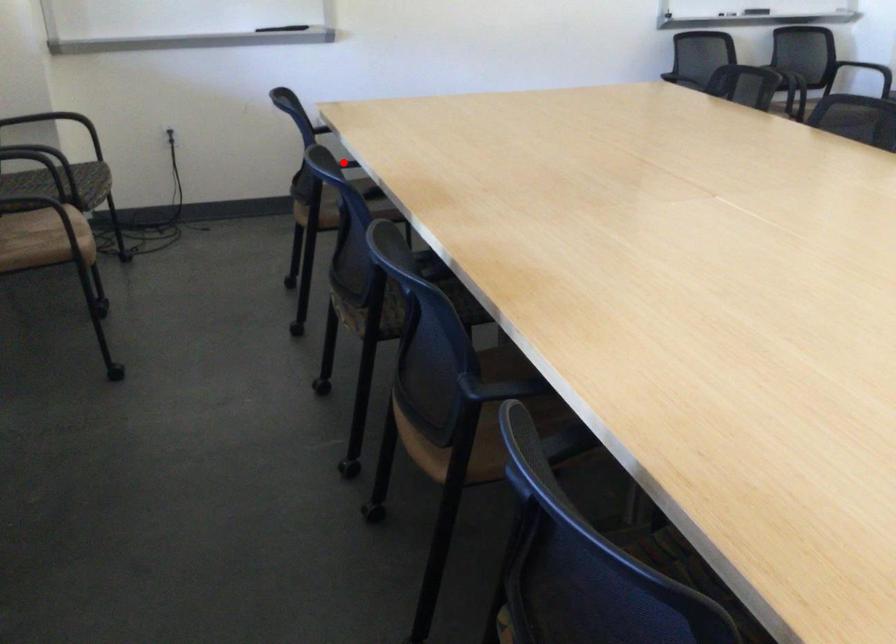
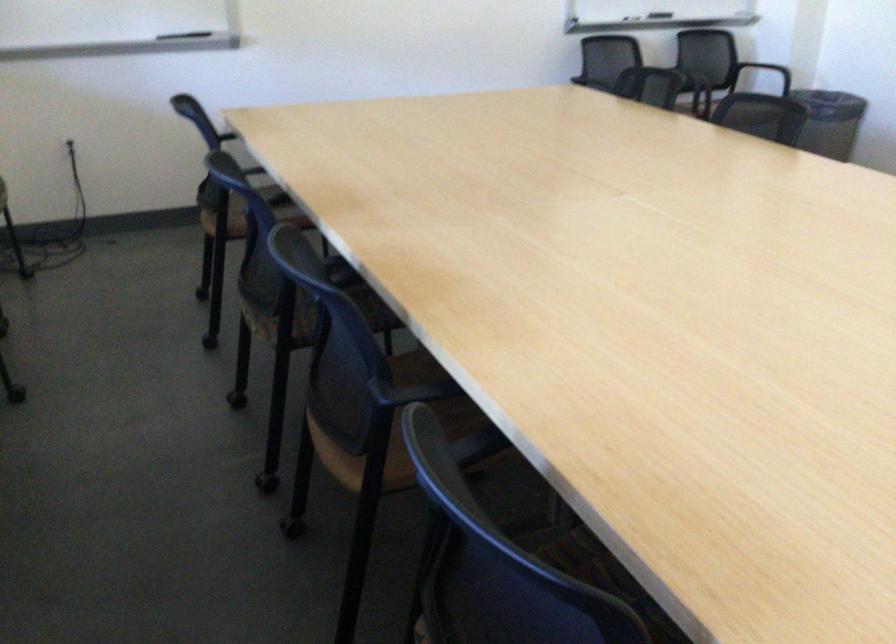
Where in the second image is the point corresponding to the highlighted location from the first image?

(253, 169)